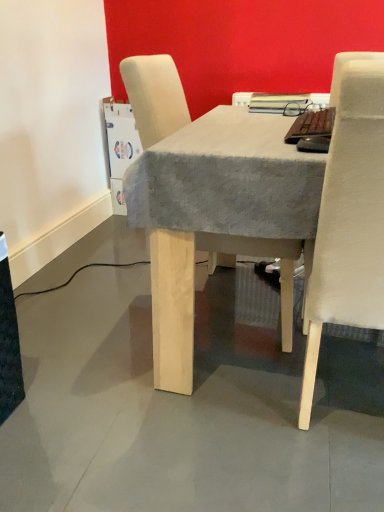
Question: Is beige fabric chair at center, the first chair in the left-to-right sequence, not close to beige fabric chair at right, placed as the first chair when sorted from right to left?

Choices:
 (A) yes
 (B) no

Answer: (B)

Question: Can beige fabric chair at right, placed as the first chair when sorted from right to left, be found inside beige fabric chair at center, positioned as the second chair in right-to-left order?

Choices:
 (A) no
 (B) yes

Answer: (A)

Question: Can you confirm if beige fabric chair at center, the first chair in the left-to-right sequence, is shorter than beige fabric chair at right, arranged as the 2th chair when viewed from the left?

Choices:
 (A) yes
 (B) no

Answer: (A)

Question: Is beige fabric chair at center, positioned as the second chair in right-to-left order, smaller than beige fabric chair at right, placed as the first chair when sorted from right to left?

Choices:
 (A) no
 (B) yes

Answer: (A)

Question: Is beige fabric chair at center, positioned as the second chair in right-to-left order, positioned before beige fabric chair at right, arranged as the 2th chair when viewed from the left?

Choices:
 (A) no
 (B) yes

Answer: (A)

Question: Is beige fabric chair at center, positioned as the second chair in right-to-left order, with beige fabric chair at right, arranged as the 2th chair when viewed from the left?

Choices:
 (A) no
 (B) yes

Answer: (A)

Question: From the image's perspective, is beige fabric chair at right, placed as the first chair when sorted from right to left, over beige fabric chair at center, the first chair in the left-to-right sequence?

Choices:
 (A) no
 (B) yes

Answer: (A)

Question: Considering the relative sizes of beige fabric chair at right, arranged as the 2th chair when viewed from the left, and beige fabric chair at center, the first chair in the left-to-right sequence, in the image provided, is beige fabric chair at right, arranged as the 2th chair when viewed from the left, smaller than beige fabric chair at center, the first chair in the left-to-right sequence,?

Choices:
 (A) yes
 (B) no

Answer: (A)

Question: Is beige fabric chair at right, placed as the first chair when sorted from right to left, further to camera compared to beige fabric chair at center, positioned as the second chair in right-to-left order?

Choices:
 (A) yes
 (B) no

Answer: (B)

Question: Are beige fabric chair at right, arranged as the 2th chair when viewed from the left, and beige fabric chair at center, positioned as the second chair in right-to-left order, beside each other?

Choices:
 (A) no
 (B) yes

Answer: (A)

Question: Considering the relative positions of beige fabric chair at right, placed as the first chair when sorted from right to left, and beige fabric chair at center, the first chair in the left-to-right sequence, in the image provided, is beige fabric chair at right, placed as the first chair when sorted from right to left, to the right of beige fabric chair at center, the first chair in the left-to-right sequence, from the viewer's perspective?

Choices:
 (A) yes
 (B) no

Answer: (A)

Question: Is the position of beige fabric chair at right, arranged as the 2th chair when viewed from the left, less distant than that of beige fabric chair at center, the first chair in the left-to-right sequence?

Choices:
 (A) no
 (B) yes

Answer: (B)

Question: From the image's perspective, is beige fabric chair at center, positioned as the second chair in right-to-left order, located above or below beige fabric chair at right, arranged as the 2th chair when viewed from the left?

Choices:
 (A) above
 (B) below

Answer: (A)